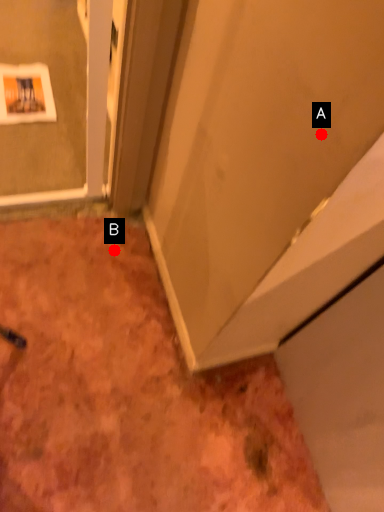
Question: Two points are circled on the image, labeled by A and B beside each circle. Among these points, which one is farthest from the camera?

Choices:
 (A) A is further
 (B) B is further

Answer: (B)